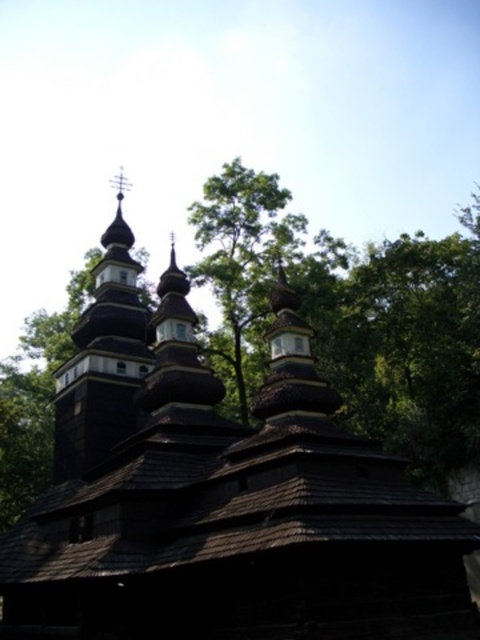
You are an architect planning to install a new lighting system between the dark wood church at center and the dark brown wooden tower at upper left. The lights require a minimum distance of 5 meters between fixtures for safety. Can the spacing between these two structures accommodate the safety requirement?

The dark wood church at center is 5.62 meters from the dark brown wooden tower at upper left, which exceeds the required 5 meters, so the spacing between these two structures can accommodate the safety requirement.

You are an architect visiting a historical site and want to compare the two wooden structures in the image. Which one is bigger in size between the dark wood church at center and the dark brown wooden tower at upper left?

The dark wood church at center has a larger size compared to the dark brown wooden tower at upper left, so the dark wood church at center is bigger.

You are standing in front of the dark wood church at center and want to take a photo of the dark brown wooden tower at upper left. Which direction should you face to capture the tower in your shot?

You should face upward because the dark wood church at center is below the dark brown wooden tower at upper left, so looking upward will allow you to capture the tower in your photo.